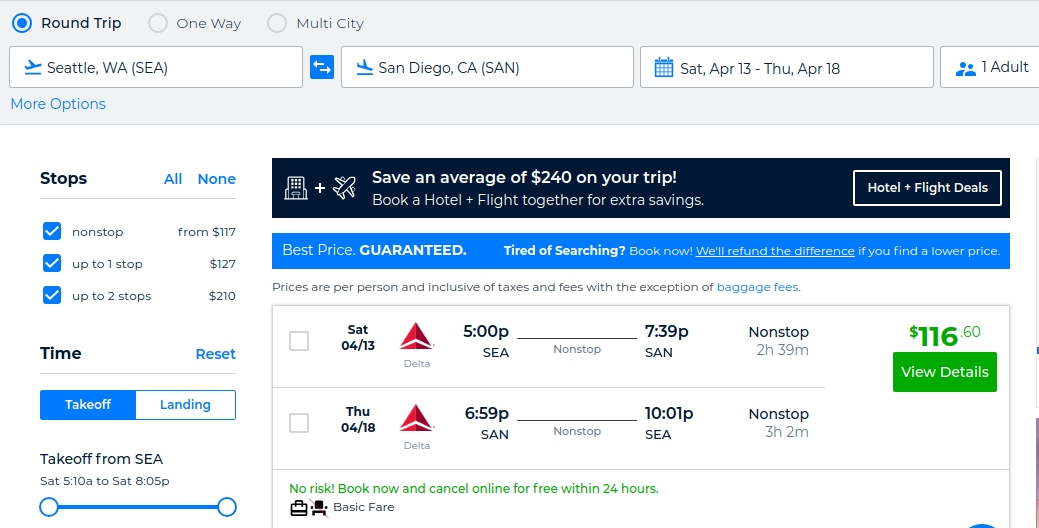
You are a GUI agent. You are given a task and a screenshot of the screen. Output one action in this format:
    pyautogui.click(x=<x>, y=<y>)
    Task: Click on the landing
    This screenshot has height=528, width=1039.
    Given the screenshot: What is the action you would take?
    pyautogui.click(x=186, y=404)